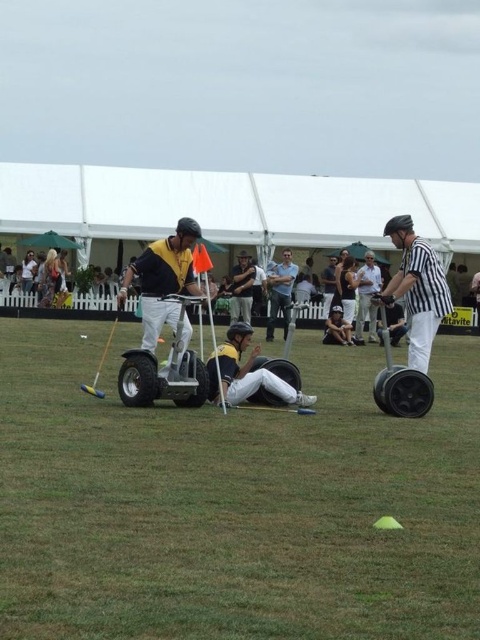
Question: Which object is closer to the camera taking this photo?

Choices:
 (A) yellow helmet at center
 (B) matte yellow helmet at center
 (C) black striped shirt at center

Answer: (A)

Question: Is black rubber segway at right smaller than dark gray fabric jacket at center?

Choices:
 (A) yes
 (B) no

Answer: (B)

Question: Which point appears closest to the camera in this image?

Choices:
 (A) (245, 336)
 (B) (412, 312)
 (C) (192, 400)
 (D) (374, 284)

Answer: (C)

Question: Can you confirm if black striped shirt at center is positioned below white striped shirt at center?

Choices:
 (A) no
 (B) yes

Answer: (B)

Question: Considering the real-world distances, which object is closest to the black striped shirt at center?

Choices:
 (A) silver metallic segway at center
 (B) yellow helmet at center

Answer: (B)

Question: Is black striped shirt at center wider than silver metallic segway at center?

Choices:
 (A) no
 (B) yes

Answer: (A)